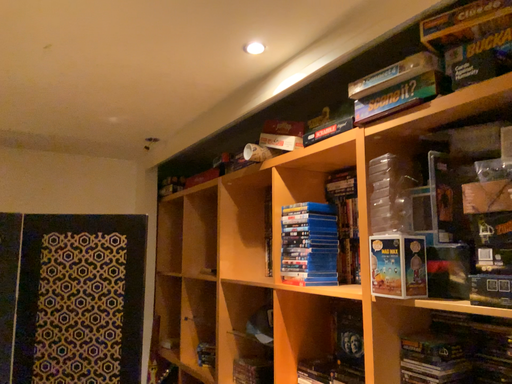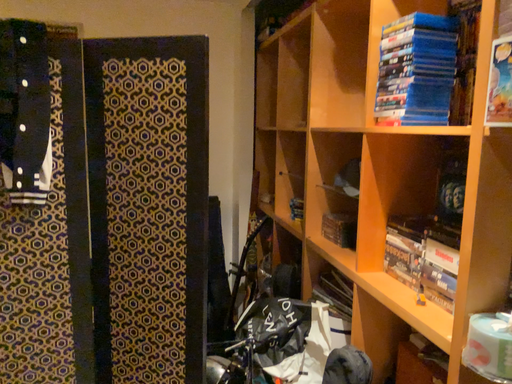
Question: How did the camera likely rotate when shooting the video?

Choices:
 (A) rotated downward
 (B) rotated upward

Answer: (A)